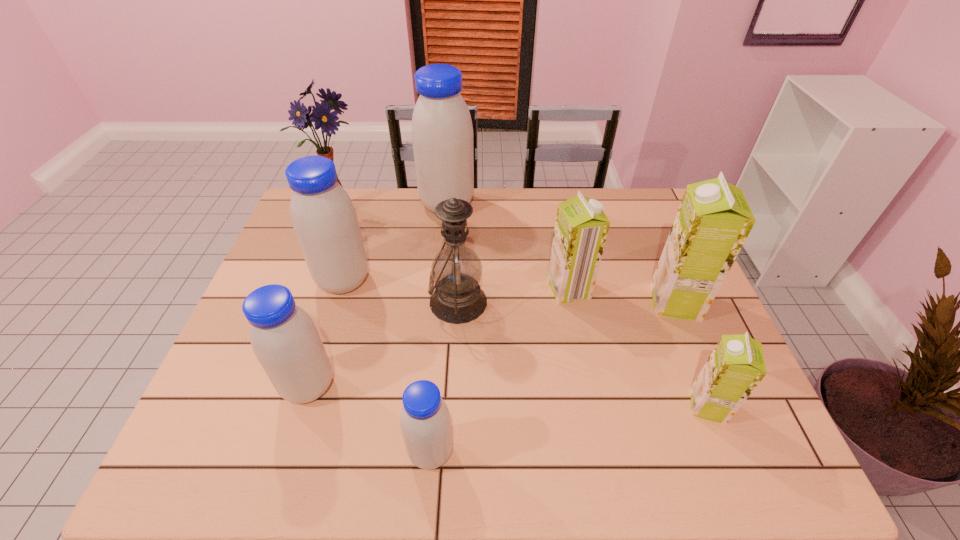
Identify the location of the nearest blue soya milk. (425, 422).

This screenshot has width=960, height=540. In order to click on the smallest blue soya milk in this screenshot , I will do `click(425, 422)`.

Find the location of a particular element. Image resolution: width=960 pixels, height=540 pixels. vacant space located 0.320m on the front of the tallest soya milk is located at coordinates (439, 292).

Find the location of a particular element. The height and width of the screenshot is (540, 960). free spot located 0.250m on the right of the purple flower arrangement is located at coordinates (441, 212).

Identify the location of free point located 0.400m on the back of the biggest green soya milk. The width and height of the screenshot is (960, 540). (634, 202).

Locate an element on the screen. This screenshot has width=960, height=540. vacant space situated on the front of the second farthest blue soya milk is located at coordinates (332, 318).

The image size is (960, 540). I want to click on vacant space located on the left of the gray oil lamp, so click(x=317, y=302).

What are the coordinates of `free location located on the front of the third farthest blue soya milk` in the screenshot? It's located at pyautogui.click(x=281, y=475).

Identify the location of vacant region located 0.300m on the right of the seventh object from left to right. The height and width of the screenshot is (540, 960). (695, 289).

Where is `vacant space located 0.060m on the front of the nearest green soya milk`? vacant space located 0.060m on the front of the nearest green soya milk is located at coordinates (726, 452).